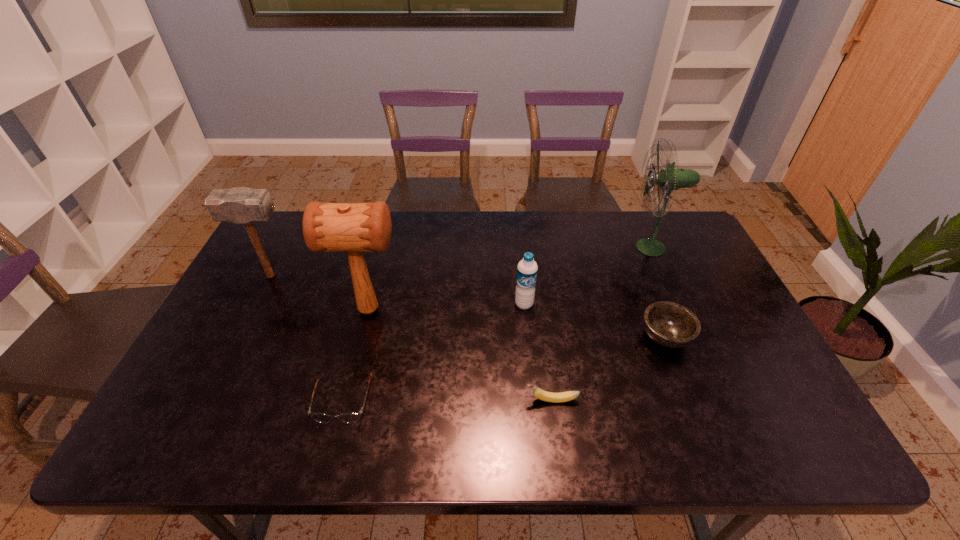
Image resolution: width=960 pixels, height=540 pixels. Find the location of `free spot between the fourth shortest object and the fan`. free spot between the fourth shortest object and the fan is located at coordinates (588, 276).

Where is `free point between the fan and the spectacles`? This screenshot has height=540, width=960. free point between the fan and the spectacles is located at coordinates (497, 324).

Where is `vacant space that is in between the spectacles and the farther mallet`? vacant space that is in between the spectacles and the farther mallet is located at coordinates (307, 338).

The width and height of the screenshot is (960, 540). Identify the location of vacant space in between the bowl and the banana. (609, 368).

What are the coordinates of `free spot between the taller mallet and the shorter mallet` in the screenshot? It's located at (320, 293).

Locate an element on the screen. The width and height of the screenshot is (960, 540). free space between the water bottle and the right mallet is located at coordinates (446, 307).

Locate an element on the screen. The height and width of the screenshot is (540, 960). free point between the bowl and the water bottle is located at coordinates (594, 321).

Identify the location of free spot between the bowl and the spectacles. (504, 368).

Image resolution: width=960 pixels, height=540 pixels. Identify the location of free area in between the nearer mallet and the third tallest object. (320, 293).

Select which object is the fourth closest to the left mallet. Please provide its 2D coordinates. Your answer should be formatted as a tuple, i.e. [(x, y)], where the tuple contains the x and y coordinates of a point satisfying the conditions above.

[(543, 395)]